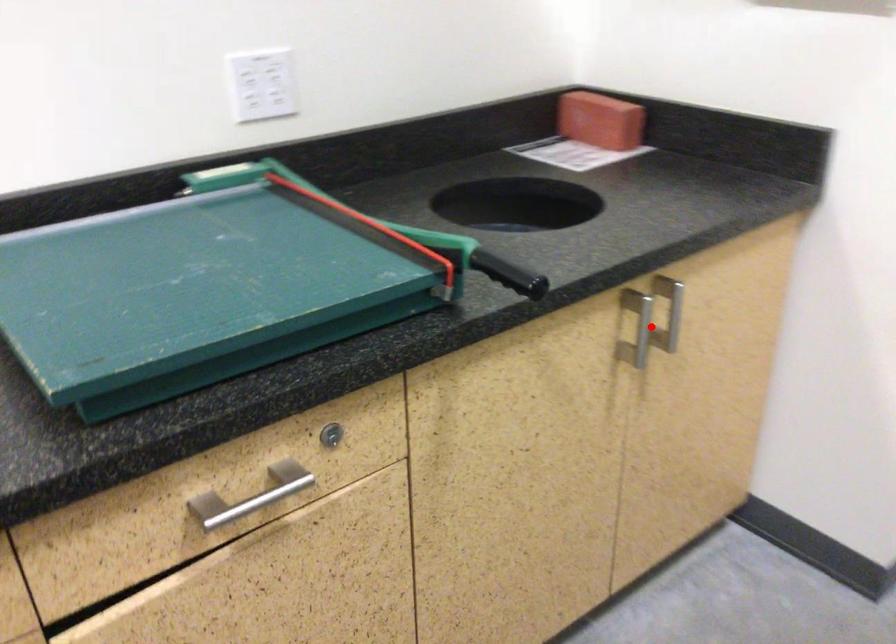
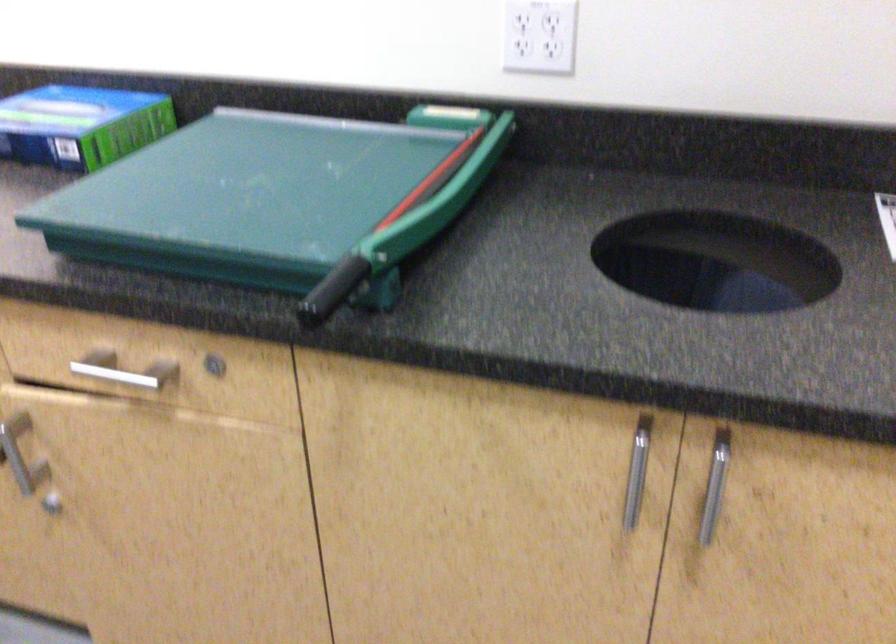
Find the pixel in the second image that matches the highlighted location in the first image.

(636, 471)